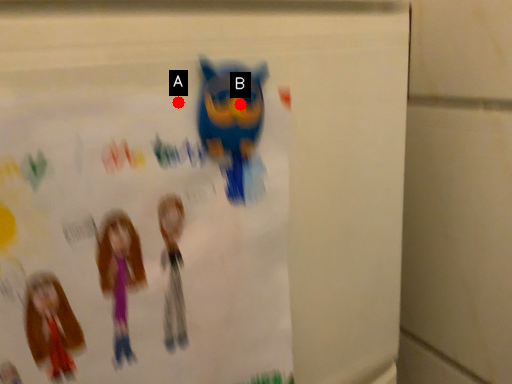
Question: Two points are circled on the image, labeled by A and B beside each circle. Among these points, which one is nearest to the camera?

Choices:
 (A) A is closer
 (B) B is closer

Answer: (A)